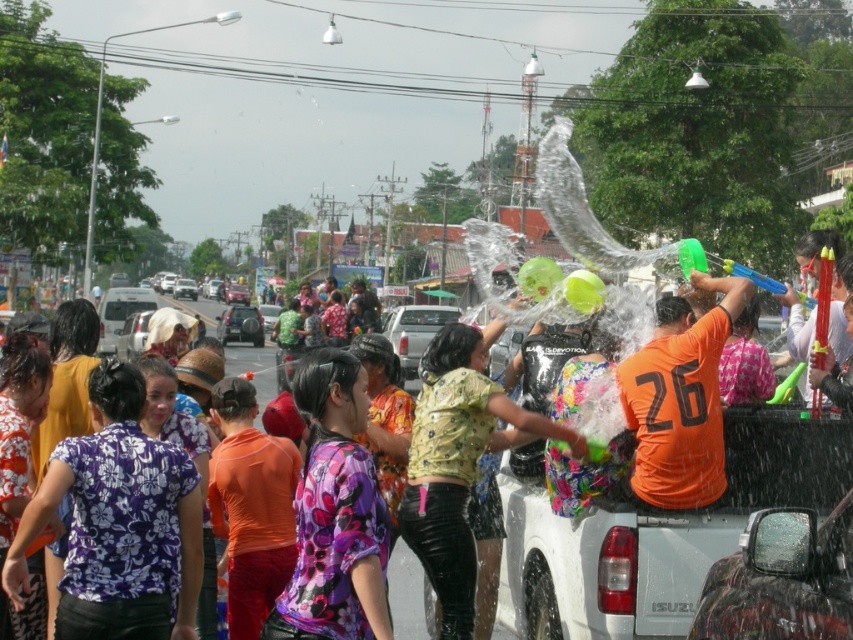
What do you see at coordinates (782, 579) in the screenshot?
I see `clear plastic mirror at lower right` at bounding box center [782, 579].

Is point (833, 589) behind point (233, 310)?

No, (833, 589) is in front of (233, 310).

Where is `clear plastic mirror at lower right`? The height and width of the screenshot is (640, 853). clear plastic mirror at lower right is located at coordinates (782, 579).

Is purple floral shirt at center in front of white matte truck at center?

Yes, purple floral shirt at center is closer to the viewer.

Does point (99, 573) lie in front of point (433, 320)?

Yes, point (99, 573) is in front of point (433, 320).

At what (x,y) coordinates should I click in order to perform the action: click on purple floral shirt at center. Please return your answer as a coordinate pair (x, y). The image size is (853, 640). Looking at the image, I should click on (119, 524).

Identify the location of floral fabric blouse at center. (334, 513).

Who is lower down, floral fabric blouse at center or orange matte shirt at center?

floral fabric blouse at center

Image resolution: width=853 pixels, height=640 pixels. What do you see at coordinates (334, 513) in the screenshot?
I see `floral fabric blouse at center` at bounding box center [334, 513].

Where is `floral fabric blouse at center`? This screenshot has width=853, height=640. floral fabric blouse at center is located at coordinates (334, 513).